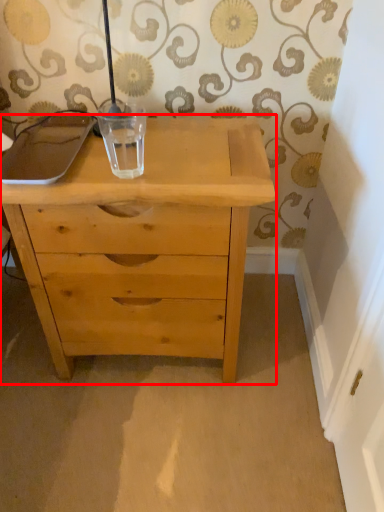
Question: From the image's perspective, what is the correct spatial positioning of chest of drawers (annotated by the red box) in reference to glass vase?

Choices:
 (A) below
 (B) above

Answer: (A)